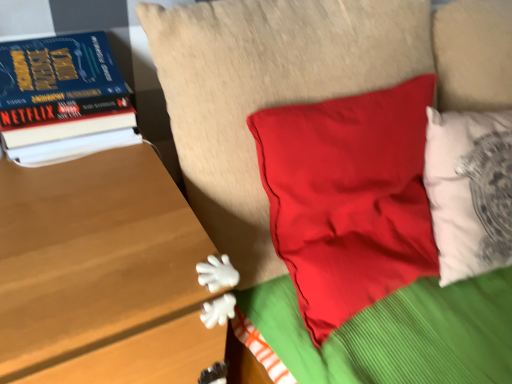
The width and height of the screenshot is (512, 384). What are the coordinates of `free point above hardcover book at left (from a real-world perspective)` in the screenshot? It's located at (60, 40).